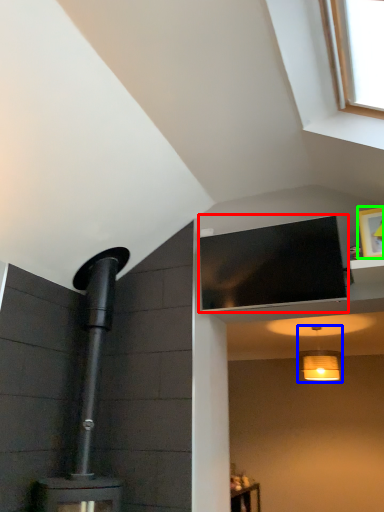
Question: Which object is the closest to the window screen (highlighted by a red box)? Choose among these: light fixture (highlighted by a blue box) or picture frame (highlighted by a green box).

Choices:
 (A) light fixture
 (B) picture frame

Answer: (B)